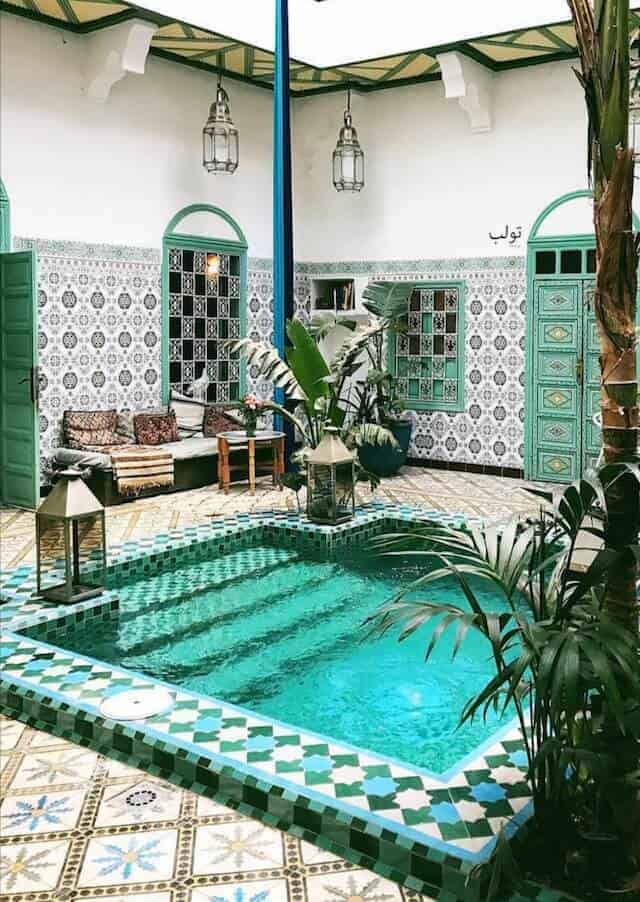
The image size is (640, 902). In order to click on hanging lights in this screenshot , I will do `click(226, 137)`, `click(352, 159)`.